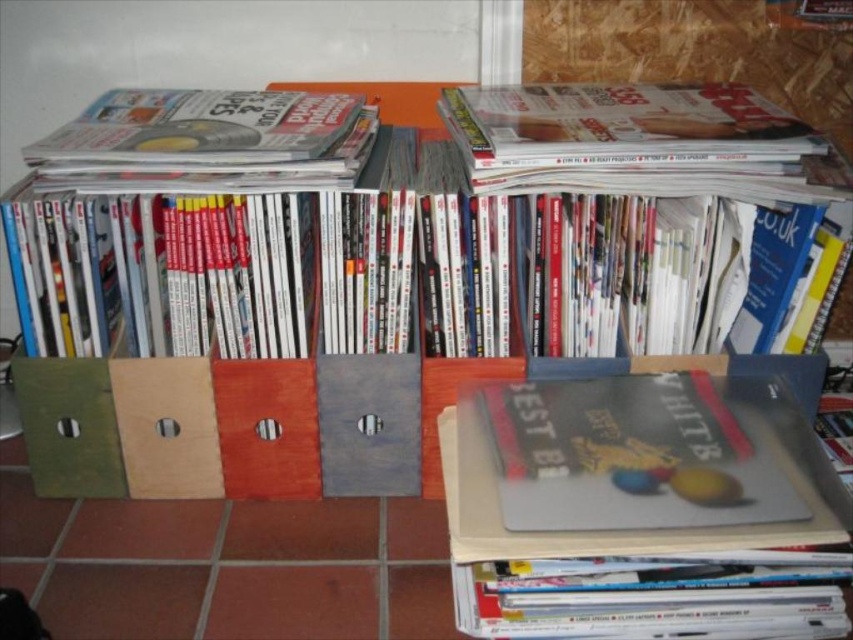
Question: Among these objects, which one is nearest to the camera?

Choices:
 (A) matte black book at center
 (B) matte gray book at center
 (C) wooden bookshelf at center

Answer: (B)

Question: Which point appears closest to the camera in this image?

Choices:
 (A) (231, 477)
 (B) (705, 508)

Answer: (B)

Question: Observing the image, what is the correct spatial positioning of wooden bookshelf at center in reference to matte black book at center?

Choices:
 (A) below
 (B) above

Answer: (B)

Question: Is wooden bookshelf at center to the left of matte gray book at center from the viewer's perspective?

Choices:
 (A) yes
 (B) no

Answer: (A)

Question: Which point is closer to the camera?

Choices:
 (A) (201, 435)
 (B) (575, 381)
 (C) (573, 387)

Answer: (C)

Question: In this image, where is wooden bookshelf at center located relative to matte gray book at center?

Choices:
 (A) above
 (B) below

Answer: (A)